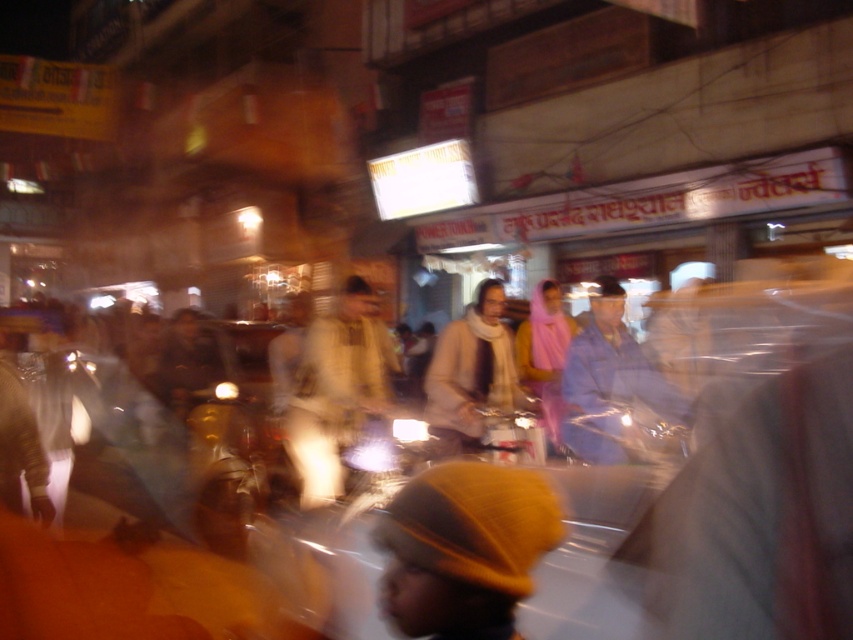
Question: Does light beige fabric at center appear on the left side of blue fabric jacket at center?

Choices:
 (A) yes
 (B) no

Answer: (A)

Question: Can you confirm if blue fabric jacket at center is positioned below white woolen scarf at center?

Choices:
 (A) no
 (B) yes

Answer: (A)

Question: Which object is closer to the camera taking this photo?

Choices:
 (A) blue fabric jacket at center
 (B) light beige fabric at center
 (C) white woolen scarf at center

Answer: (B)

Question: Which of the following is the farthest from the observer?

Choices:
 (A) pyautogui.click(x=463, y=420)
 (B) pyautogui.click(x=381, y=362)

Answer: (B)

Question: Is light beige fabric at center to the left of blue fabric jacket at center from the viewer's perspective?

Choices:
 (A) no
 (B) yes

Answer: (B)

Question: Which object is the closest to the light beige fabric at center?

Choices:
 (A) white woolen scarf at center
 (B) blue fabric jacket at center

Answer: (A)